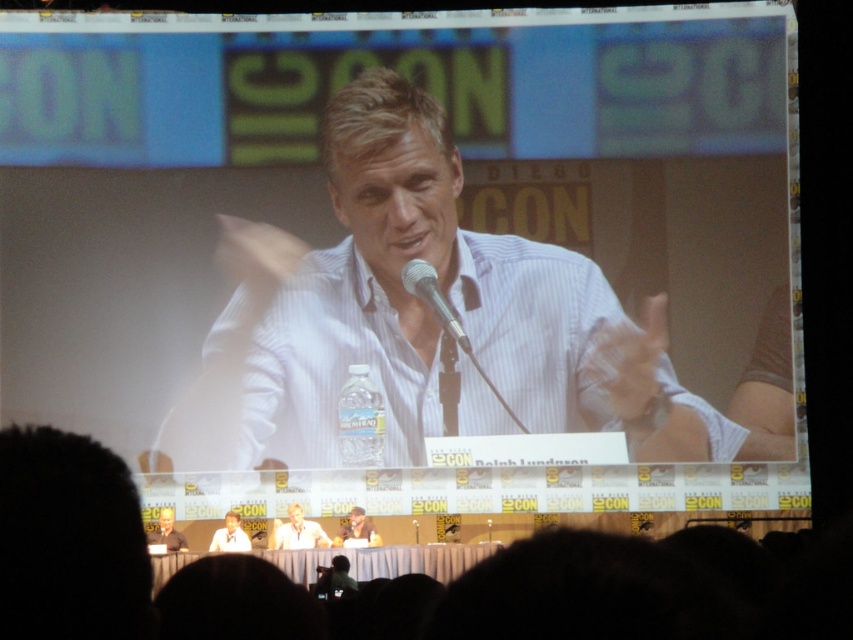
Is smooth brown leather jacket at center to the right of light brown hair at lower left from the viewer's perspective?

Correct, you'll find smooth brown leather jacket at center to the right of light brown hair at lower left.

Can you confirm if smooth brown leather jacket at center is positioned above light brown hair at lower left?

Incorrect, smooth brown leather jacket at center is not positioned above light brown hair at lower left.

Identify the location of smooth brown leather jacket at center. The width and height of the screenshot is (853, 640). (357, 529).

Can you confirm if silver metallic microphone at center is bigger than light brown wood table at lower center?

No, silver metallic microphone at center is not bigger than light brown wood table at lower center.

Between silver metallic microphone at center and light brown wood table at lower center, which one appears on the left side from the viewer's perspective?

Positioned to the left is light brown wood table at lower center.

The width and height of the screenshot is (853, 640). What are the coordinates of `silver metallic microphone at center` in the screenshot? It's located at (434, 300).

How far apart are silver metallic microphone at center and light blue striped shirt at center?

silver metallic microphone at center is 60.35 feet away from light blue striped shirt at center.

Find the location of a particular element. The width and height of the screenshot is (853, 640). silver metallic microphone at center is located at coordinates (434, 300).

Find the location of a particular element. silver metallic microphone at center is located at coordinates (434, 300).